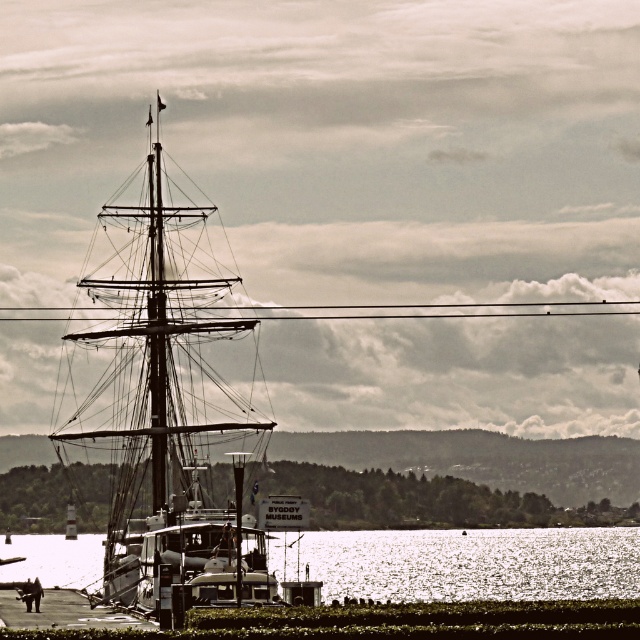
Is wooden ship at center closer to camera compared to glistening silver water at lower center?

Yes, wooden ship at center is closer to the viewer.

Is wooden ship at center to the right of glistening silver water at lower center from the viewer's perspective?

Indeed, wooden ship at center is positioned on the right side of glistening silver water at lower center.

From the picture: Who is more forward, (136, 360) or (342, 595)?

Positioned in front is point (136, 360).

Locate an element on the screen. The width and height of the screenshot is (640, 640). wooden ship at center is located at coordinates (163, 397).